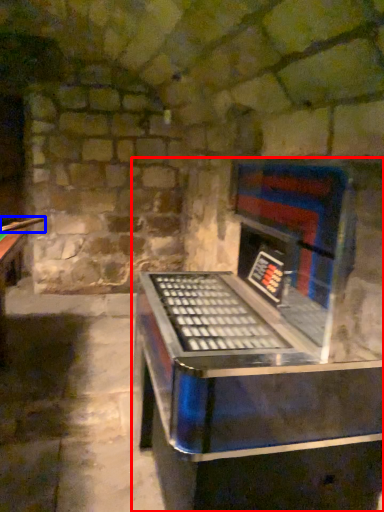
Question: Which of the following is the farthest to the observer, furniture (highlighted by a red box) or cue (highlighted by a blue box)?

Choices:
 (A) furniture
 (B) cue

Answer: (B)